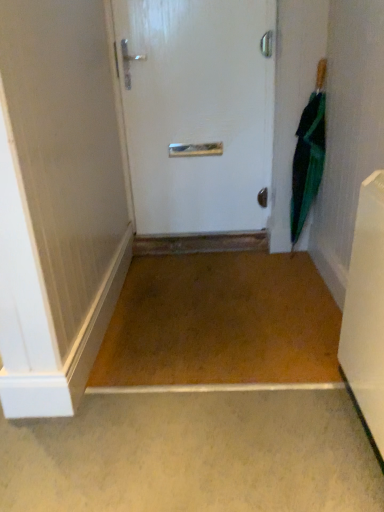
Question: Does white plastic radiator at lower right have a greater width compared to white glossy door at center?

Choices:
 (A) yes
 (B) no

Answer: (A)

Question: Does white plastic radiator at lower right lie in front of white glossy door at center?

Choices:
 (A) yes
 (B) no

Answer: (A)

Question: Considering the relative sizes of white plastic radiator at lower right and white glossy door at center in the image provided, is white plastic radiator at lower right taller than white glossy door at center?

Choices:
 (A) yes
 (B) no

Answer: (B)

Question: Is white plastic radiator at lower right aimed at white glossy door at center?

Choices:
 (A) no
 (B) yes

Answer: (A)

Question: Is white plastic radiator at lower right facing away from white glossy door at center?

Choices:
 (A) no
 (B) yes

Answer: (A)

Question: Does white plastic radiator at lower right have a lesser width compared to white glossy door at center?

Choices:
 (A) yes
 (B) no

Answer: (B)

Question: From a real-world perspective, is white glossy door at center located higher than white plastic radiator at lower right?

Choices:
 (A) no
 (B) yes

Answer: (B)

Question: Considering the relative sizes of white glossy door at center and white plastic radiator at lower right in the image provided, is white glossy door at center bigger than white plastic radiator at lower right?

Choices:
 (A) yes
 (B) no

Answer: (A)

Question: Is white glossy door at center closer to camera compared to white plastic radiator at lower right?

Choices:
 (A) yes
 (B) no

Answer: (B)

Question: Is white glossy door at center oriented away from white plastic radiator at lower right?

Choices:
 (A) yes
 (B) no

Answer: (B)

Question: Can you confirm if white glossy door at center is smaller than white plastic radiator at lower right?

Choices:
 (A) no
 (B) yes

Answer: (A)

Question: Is white glossy door at center shorter than white plastic radiator at lower right?

Choices:
 (A) no
 (B) yes

Answer: (A)

Question: Considering the relative sizes of white plastic radiator at lower right and green matte umbrella at right in the image provided, is white plastic radiator at lower right smaller than green matte umbrella at right?

Choices:
 (A) no
 (B) yes

Answer: (A)